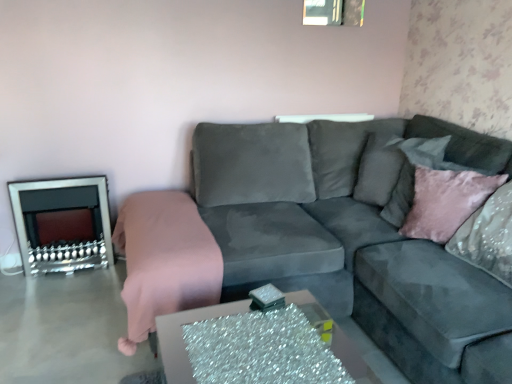
Question: Does silver metallic fireplace at left lie in front of velvet gray pillow at upper right?

Choices:
 (A) no
 (B) yes

Answer: (A)

Question: From the image's perspective, would you say silver metallic fireplace at left is shown under velvet gray pillow at upper right?

Choices:
 (A) yes
 (B) no

Answer: (A)

Question: Does silver metallic fireplace at left have a smaller size compared to velvet gray pillow at upper right?

Choices:
 (A) no
 (B) yes

Answer: (A)

Question: Are silver metallic fireplace at left and velvet gray pillow at upper right located far from each other?

Choices:
 (A) no
 (B) yes

Answer: (B)

Question: From a real-world perspective, does silver metallic fireplace at left sit lower than velvet gray pillow at upper right?

Choices:
 (A) no
 (B) yes

Answer: (B)

Question: Is silver metallic fireplace at left outside of velvet gray pillow at upper right?

Choices:
 (A) yes
 (B) no

Answer: (A)

Question: Is silver metallic fireplace at left thinner than sparkly silver table at center?

Choices:
 (A) yes
 (B) no

Answer: (A)

Question: Is the depth of silver metallic fireplace at left less than that of sparkly silver table at center?

Choices:
 (A) yes
 (B) no

Answer: (B)

Question: Are silver metallic fireplace at left and sparkly silver table at center making contact?

Choices:
 (A) no
 (B) yes

Answer: (A)

Question: Considering the relative sizes of silver metallic fireplace at left and sparkly silver table at center in the image provided, is silver metallic fireplace at left taller than sparkly silver table at center?

Choices:
 (A) no
 (B) yes

Answer: (B)

Question: Is there a large distance between silver metallic fireplace at left and sparkly silver table at center?

Choices:
 (A) no
 (B) yes

Answer: (B)

Question: Is silver metallic fireplace at left not inside sparkly silver table at center?

Choices:
 (A) no
 (B) yes

Answer: (B)

Question: Can you confirm if velvet gray couch at center is smaller than silver metallic fireplace at left?

Choices:
 (A) no
 (B) yes

Answer: (A)